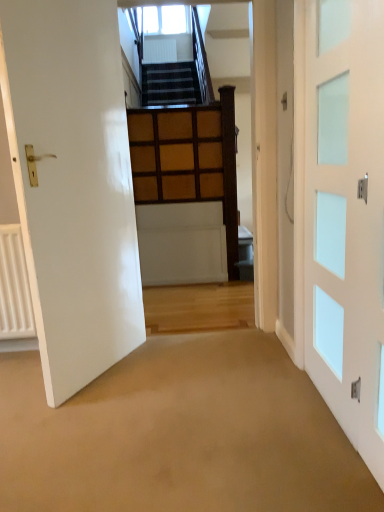
Question: From the image's perspective, relative to white glossy door at left, the 1th door in the left-to-right sequence, is white glass door at right, which appears as the 2th door when viewed from the left, above or below?

Choices:
 (A) above
 (B) below

Answer: (B)

Question: Based on their positions, is white glass door at right, which is the 1th door in right-to-left order, located to the left or right of white glossy door at left, arranged as the 2th door when viewed from the right?

Choices:
 (A) left
 (B) right

Answer: (B)

Question: Which object is positioned farthest from the clear glass window at upper center?

Choices:
 (A) white glossy door at left, the 1th door in the left-to-right sequence
 (B) white glass door at right, which appears as the 2th door when viewed from the left

Answer: (B)

Question: Based on their relative distances, which object is nearer to the white glass door at right, which appears as the 2th door when viewed from the left?

Choices:
 (A) white glossy door at left, arranged as the 2th door when viewed from the right
 (B) clear glass window at upper center

Answer: (A)